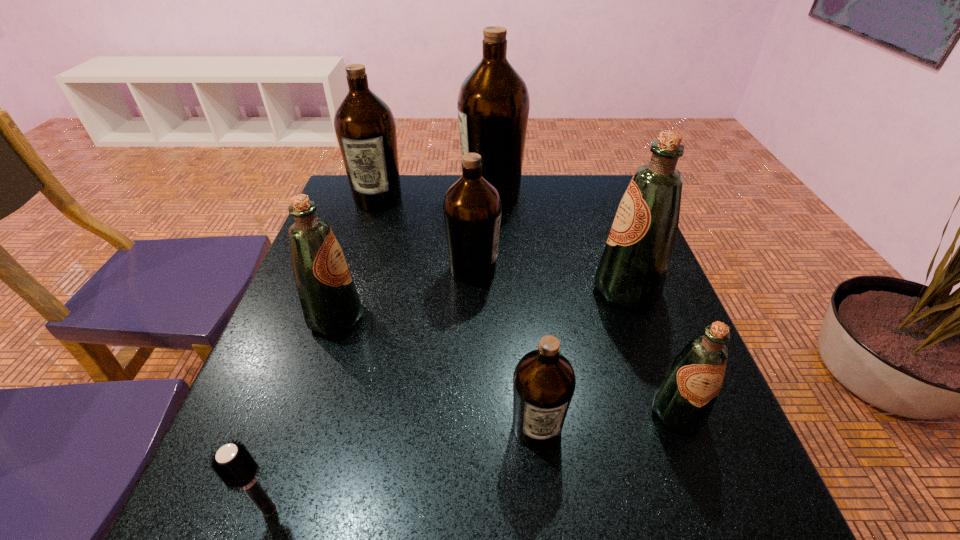
The height and width of the screenshot is (540, 960). In order to click on the tallest olive oil in this screenshot , I will do `click(493, 104)`.

Find the location of a particular element. This screenshot has height=540, width=960. the tallest object is located at coordinates (493, 104).

In order to click on the second biggest brown olive oil in this screenshot , I will do 365,127.

Where is `the biggest green olive oil`? The image size is (960, 540). the biggest green olive oil is located at coordinates (632, 271).

Locate an element on the screen. the second biggest green olive oil is located at coordinates (329, 299).

The image size is (960, 540). I want to click on the third farthest brown olive oil, so click(472, 207).

Find the location of a particular element. Image resolution: width=960 pixels, height=540 pixels. the smallest brown olive oil is located at coordinates (544, 382).

Image resolution: width=960 pixels, height=540 pixels. Identify the location of the smallest green olive oil. (683, 400).

At what (x,y) coordinates should I click in order to perform the action: click on the nearest object. Please return your answer as a coordinate pair (x, y). This screenshot has width=960, height=540. Looking at the image, I should click on (235, 466).

Locate an element on the screen. hairbrush is located at coordinates (235, 466).